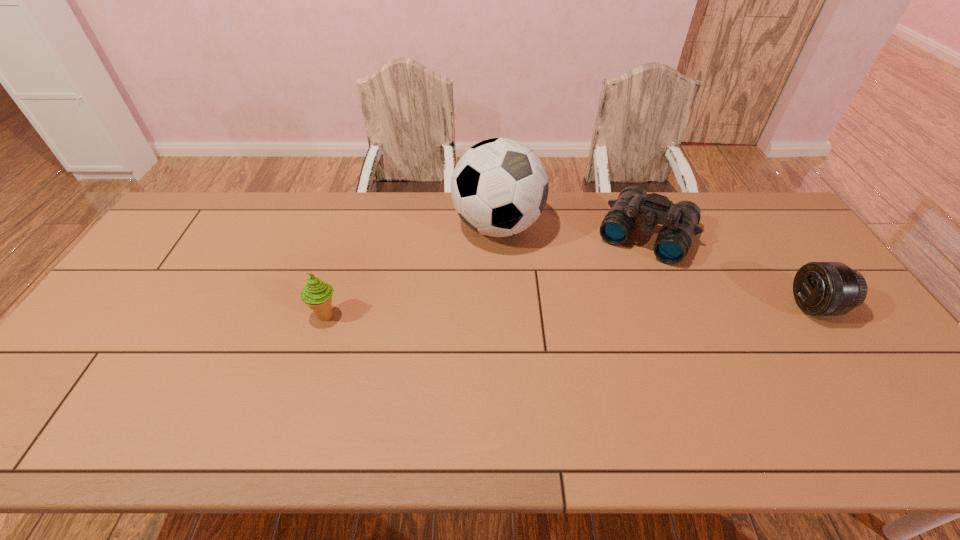
At what (x,y) coordinates should I click in order to perform the action: click on vacant area at the left edge of the desktop. Please return your answer as a coordinate pair (x, y). This screenshot has width=960, height=540. Looking at the image, I should click on (151, 326).

In the image, there is a desktop. At what (x,y) coordinates should I click in order to perform the action: click on free space at the right edge. Please return your answer as a coordinate pair (x, y). Looking at the image, I should click on (773, 267).

This screenshot has width=960, height=540. Identify the location of free spot at the far right corner of the desktop. (748, 193).

You are a GUI agent. You are given a task and a screenshot of the screen. Output one action in this format:
    pyautogui.click(x=<x>, y=<y>)
    Task: Click on the vacant space that's between the icecream and the rightmost object
    The height and width of the screenshot is (540, 960).
    Given the screenshot: What is the action you would take?
    coord(570,310)

You are a GUI agent. You are given a task and a screenshot of the screen. Output one action in this format:
    pyautogui.click(x=<x>, y=<y>)
    Task: Click on the free space between the leftmost object and the rightmost object
    This screenshot has height=540, width=960.
    Given the screenshot: What is the action you would take?
    pyautogui.click(x=570, y=310)

Where is `vacant area that lies between the soccer ball and the rightmost object`? This screenshot has height=540, width=960. vacant area that lies between the soccer ball and the rightmost object is located at coordinates (657, 266).

At what (x,y) coordinates should I click in order to perform the action: click on empty space between the second object from right to left and the telephoto lens. Please return your answer as a coordinate pair (x, y). Image resolution: width=960 pixels, height=540 pixels. Looking at the image, I should click on (731, 271).

At what (x,y) coordinates should I click in order to perform the action: click on free spot between the tallest object and the leftmost object. Please return your answer as a coordinate pair (x, y). The image size is (960, 540). Looking at the image, I should click on (412, 271).

Where is `vacant space in between the third object from left to right and the telephoto lens`? The width and height of the screenshot is (960, 540). vacant space in between the third object from left to right and the telephoto lens is located at coordinates (731, 271).

The image size is (960, 540). In order to click on unoccupied position between the telephoto lens and the third object from left to right in this screenshot , I will do `click(731, 271)`.